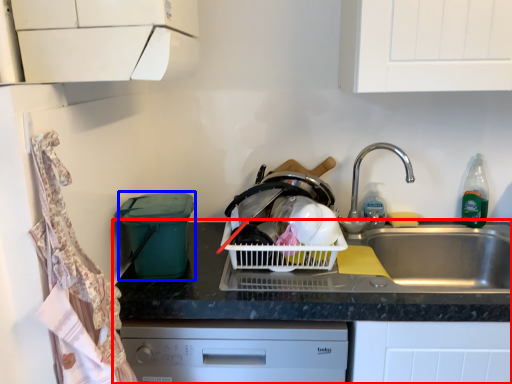
Question: Which point is further to the camera, countertop (highlighted by a red box) or appliance (highlighted by a blue box)?

Choices:
 (A) countertop
 (B) appliance

Answer: (B)